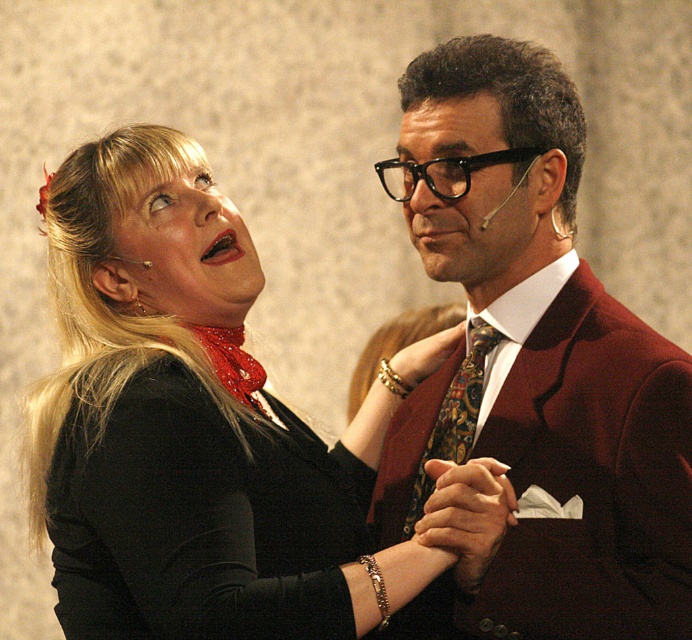
Which is more to the left, velvet burgundy suit at center or matte black face at center?

From the viewer's perspective, velvet burgundy suit at center appears more on the left side.

The image size is (692, 640). What are the coordinates of `velvet burgundy suit at center` in the screenshot? It's located at (531, 369).

Which of these two, black velvet dress at left or multicolored patterned tie at center, stands taller?

black velvet dress at left is taller.

Who is positioned more to the left, black velvet dress at left or multicolored patterned tie at center?

From the viewer's perspective, black velvet dress at left appears more on the left side.

Measure the distance between black velvet dress at left and camera.

They are 1.36 meters apart.

At what (x,y) coordinates should I click in order to perform the action: click on black velvet dress at left. Please return your answer as a coordinate pair (x, y). Looking at the image, I should click on (201, 520).

Can you confirm if black velvet dress at left is thinner than matte black face at center?

Incorrect, black velvet dress at left's width is not less than matte black face at center's.

Does black velvet dress at left appear on the left side of matte black face at center?

Correct, you'll find black velvet dress at left to the left of matte black face at center.

You are a GUI agent. You are given a task and a screenshot of the screen. Output one action in this format:
    pyautogui.click(x=<x>, y=<y>)
    Task: Click on the black velvet dress at left
    Image resolution: width=692 pixels, height=640 pixels.
    Given the screenshot: What is the action you would take?
    pyautogui.click(x=201, y=520)